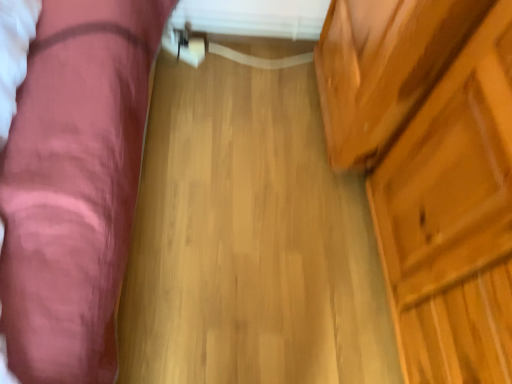
Where is `vacant space positioned to the left of wooden dresser at right`? This screenshot has height=384, width=512. vacant space positioned to the left of wooden dresser at right is located at coordinates 290,239.